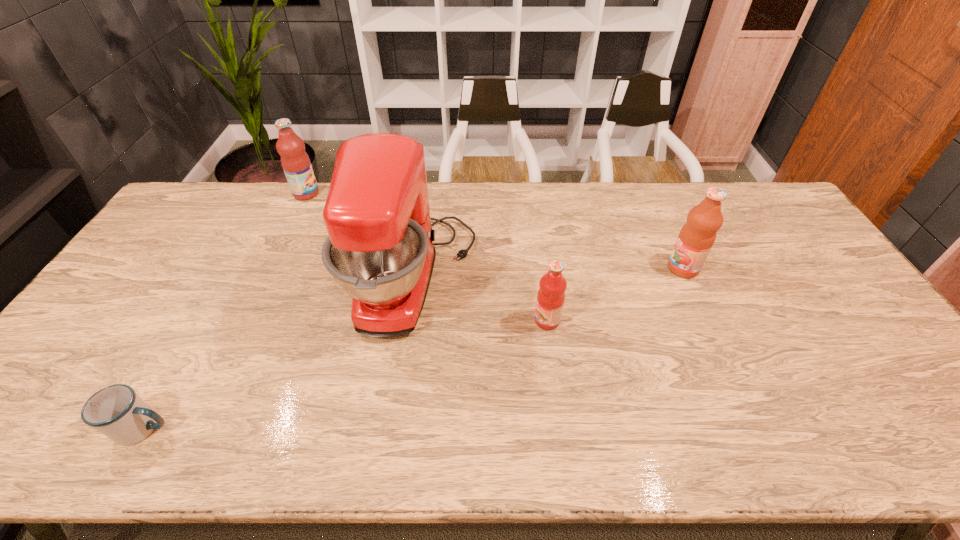
Find the location of a particular element. The height and width of the screenshot is (540, 960). fruit juice present at the far edge is located at coordinates (295, 162).

Where is `object that is positioned at the near edge`? object that is positioned at the near edge is located at coordinates (116, 411).

Locate an element on the screen. vacant space at the far edge of the desktop is located at coordinates (252, 192).

Image resolution: width=960 pixels, height=540 pixels. What are the coordinates of `blank space at the left edge` in the screenshot? It's located at click(188, 241).

In the image, there is a desktop. What are the coordinates of `vacant space at the right edge` in the screenshot? It's located at (815, 289).

Where is `vacant region at the far right corner of the desktop`? vacant region at the far right corner of the desktop is located at coordinates (738, 185).

The width and height of the screenshot is (960, 540). I want to click on unoccupied position between the leftmost object and the farthest fruit juice, so click(x=226, y=311).

This screenshot has width=960, height=540. I want to click on vacant space that is in between the kitchen mixer and the shortest object, so click(x=279, y=354).

This screenshot has width=960, height=540. What are the coordinates of `vacant area that lies between the mug and the tallest object` in the screenshot? It's located at (279, 354).

Where is `free space that is in between the mug and the rightmost object`? This screenshot has height=540, width=960. free space that is in between the mug and the rightmost object is located at coordinates (414, 348).